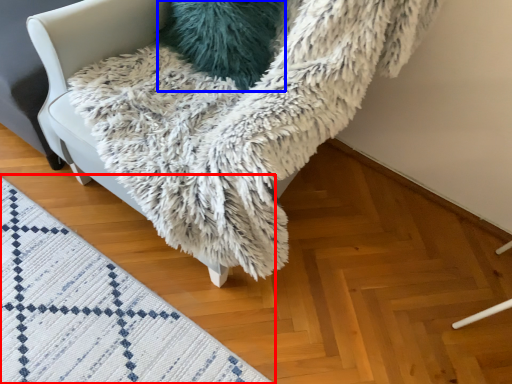
Question: Which object is further to the camera taking this photo, mat (highlighted by a red box) or pillow (highlighted by a blue box)?

Choices:
 (A) mat
 (B) pillow

Answer: (B)